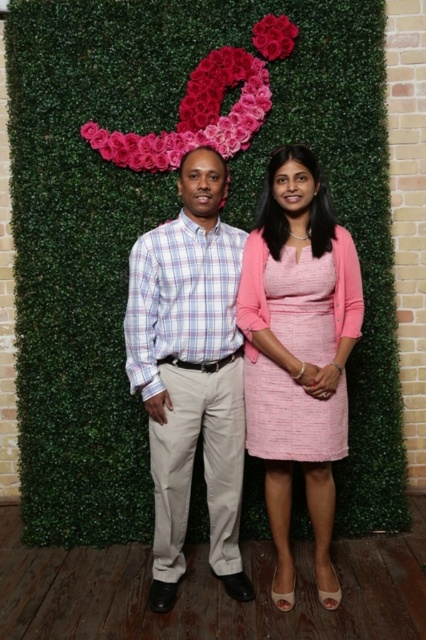
Question: Is plaid cotton shirt at center to the right of smooth pink roses at upper center from the viewer's perspective?

Choices:
 (A) yes
 (B) no

Answer: (B)

Question: Which point is farther to the camera?

Choices:
 (A) (250, 76)
 (B) (273, 19)
 (C) (296, 342)

Answer: (A)

Question: Can you confirm if plaid cotton shirt at center is positioned above smooth pink roses at upper center?

Choices:
 (A) no
 (B) yes

Answer: (A)

Question: Estimate the real-world distances between objects in this image. Which object is closer to the smooth pink roses at upper center?

Choices:
 (A) plaid cotton shirt at center
 (B) pink floral decoration at upper center

Answer: (B)

Question: Is pink textured dress at center to the right of pink floral decoration at upper center from the viewer's perspective?

Choices:
 (A) no
 (B) yes

Answer: (B)

Question: Which of these objects is positioned closest to the smooth pink roses at upper center?

Choices:
 (A) pink textured dress at center
 (B) plaid cotton shirt at center
 (C) pink floral decoration at upper center

Answer: (C)